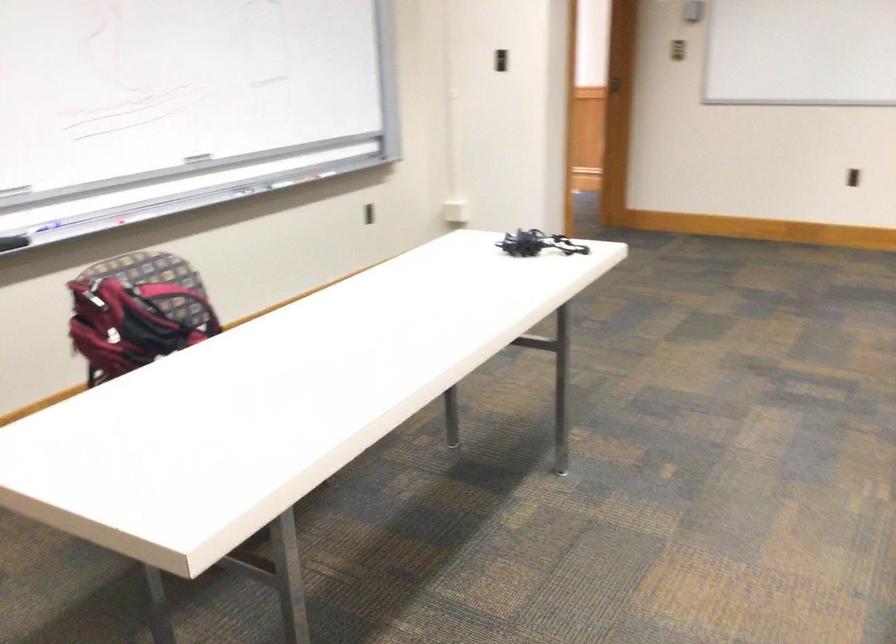
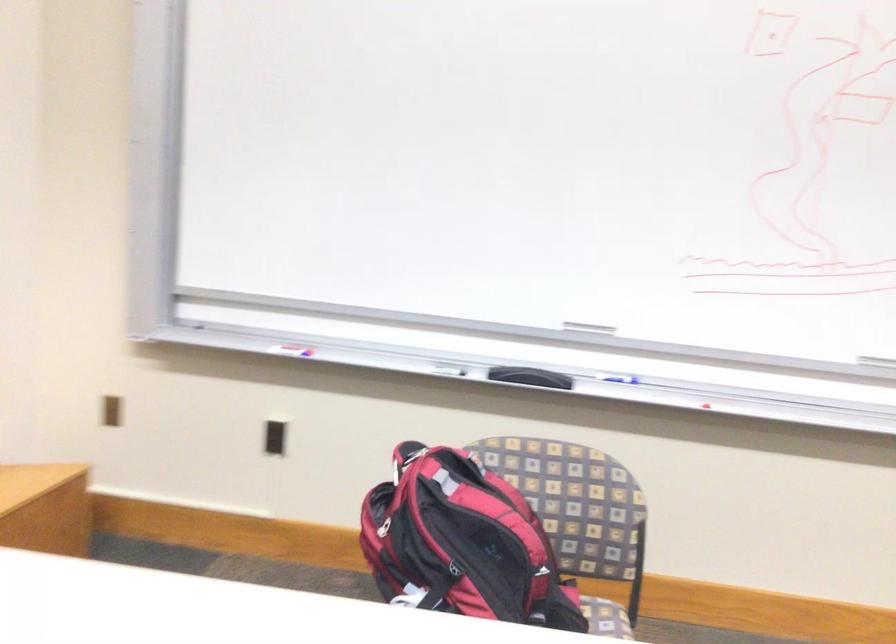
The point at (150, 327) is marked in the first image. Where is the corresponding point in the second image?

(478, 542)